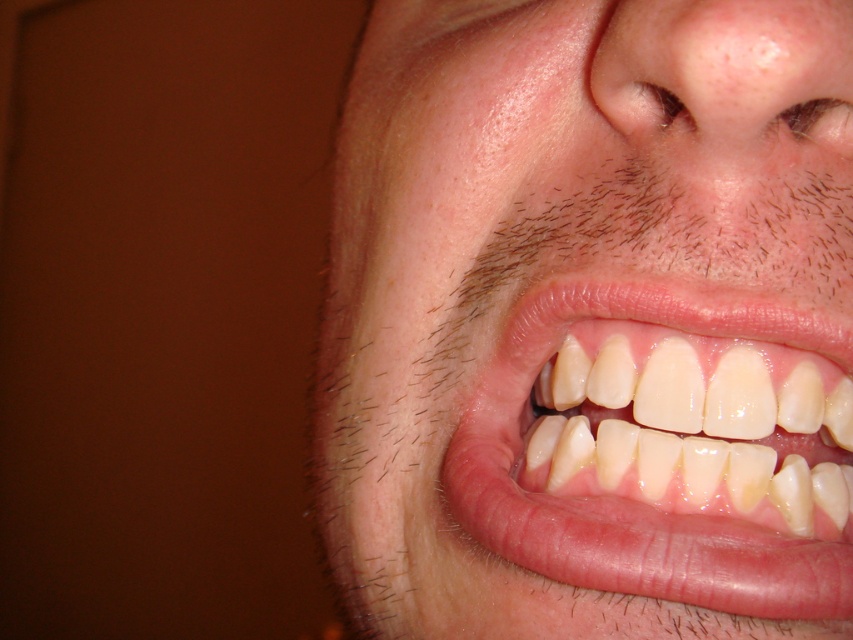
You are a dentist examining a patient. You notice a point at coordinates [570,298]. Based on the image provided, where is this point located?

The point at [570,298] is on smooth skin at center.

You are a dentist examining a patient. You notice two points in their mouth, point (664, 17) and point (607, 305). Which point is closer to your viewpoint?

Point (664, 17) is closer to the viewer than point (607, 305).

You are a dentist examining a patient. You notice the smooth skin at center and the white glossy teeth at center. How far apart are these two features?

The smooth skin at center and the white glossy teeth at center are 2.00 inches apart from each other.